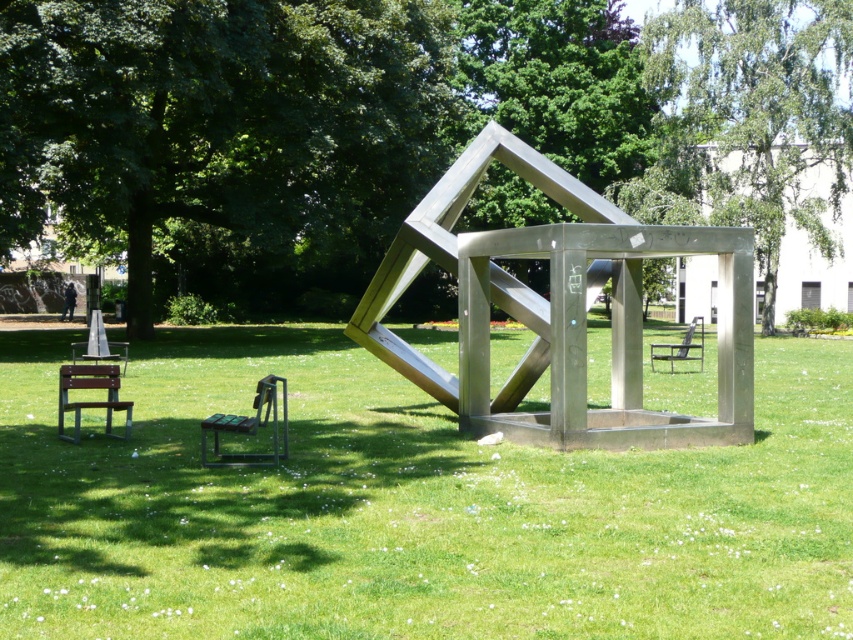
You are standing at the center of the grassy area and want to sit down. Which direction should you walk to reach the wooden park bench at lower left?

The wooden park bench at lower left is located at coordinates [91,401], so you should walk towards the lower left direction to reach it.

You are standing in the sculpture garden and want to take a photo of the polished silver cube at center. To avoid having the green leafy tree at upper right cast a shadow over it, where should you position yourself relative to the tree?

You should position yourself on the side of the green leafy tree at upper right opposite the polished silver cube at center, since the tree is above the cube and its shadow would fall in the direction away from the cube if the sun is behind you.

In the scene shown: You are a visitor sitting on the wooden park bench at lower left and want to move to the metallic silver chair at center. Which direction should you walk to reach the chair?

The wooden park bench at lower left is located below the metallic silver chair at center, so you should walk upwards to reach the chair.